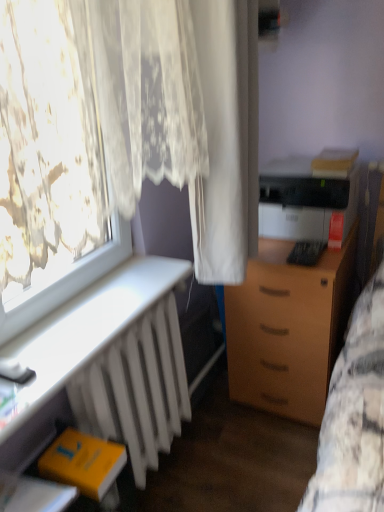
Question: Is black plastic printer at right located within white matte radiator at lower left?

Choices:
 (A) yes
 (B) no

Answer: (B)

Question: From a real-world perspective, is white matte radiator at lower left located beneath black plastic printer at right?

Choices:
 (A) no
 (B) yes

Answer: (B)

Question: Is white matte radiator at lower left bigger than black plastic printer at right?

Choices:
 (A) yes
 (B) no

Answer: (B)

Question: Is white matte radiator at lower left oriented towards black plastic printer at right?

Choices:
 (A) yes
 (B) no

Answer: (B)

Question: Considering the relative sizes of white matte radiator at lower left and black plastic printer at right in the image provided, is white matte radiator at lower left taller than black plastic printer at right?

Choices:
 (A) yes
 (B) no

Answer: (B)

Question: Considering the relative sizes of white matte radiator at lower left and black plastic printer at right in the image provided, is white matte radiator at lower left smaller than black plastic printer at right?

Choices:
 (A) no
 (B) yes

Answer: (B)

Question: From a real-world perspective, is black plastic printer at right located higher than yellow matte book at lower left?

Choices:
 (A) no
 (B) yes

Answer: (B)

Question: Is the depth of black plastic printer at right greater than that of yellow matte book at lower left?

Choices:
 (A) no
 (B) yes

Answer: (B)

Question: From a real-world perspective, is black plastic printer at right positioned under yellow matte book at lower left based on gravity?

Choices:
 (A) yes
 (B) no

Answer: (B)

Question: Can yellow matte book at lower left be found inside black plastic printer at right?

Choices:
 (A) yes
 (B) no

Answer: (B)

Question: Is black plastic printer at right thinner than yellow matte book at lower left?

Choices:
 (A) yes
 (B) no

Answer: (B)

Question: Is black plastic printer at right shorter than yellow matte book at lower left?

Choices:
 (A) yes
 (B) no

Answer: (B)

Question: Is wooden drawer at center-right located outside yellow matte book at lower left?

Choices:
 (A) yes
 (B) no

Answer: (A)